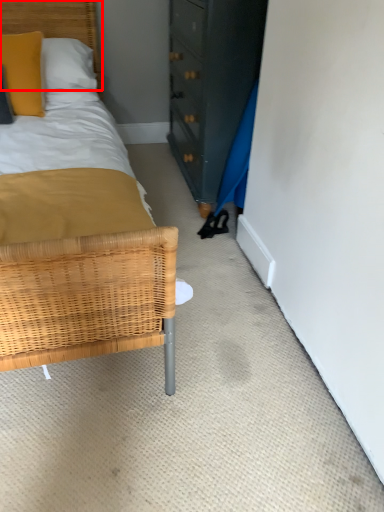
Question: From the image's perspective, where is headboard (annotated by the red box) located relative to pillow?

Choices:
 (A) above
 (B) below

Answer: (A)